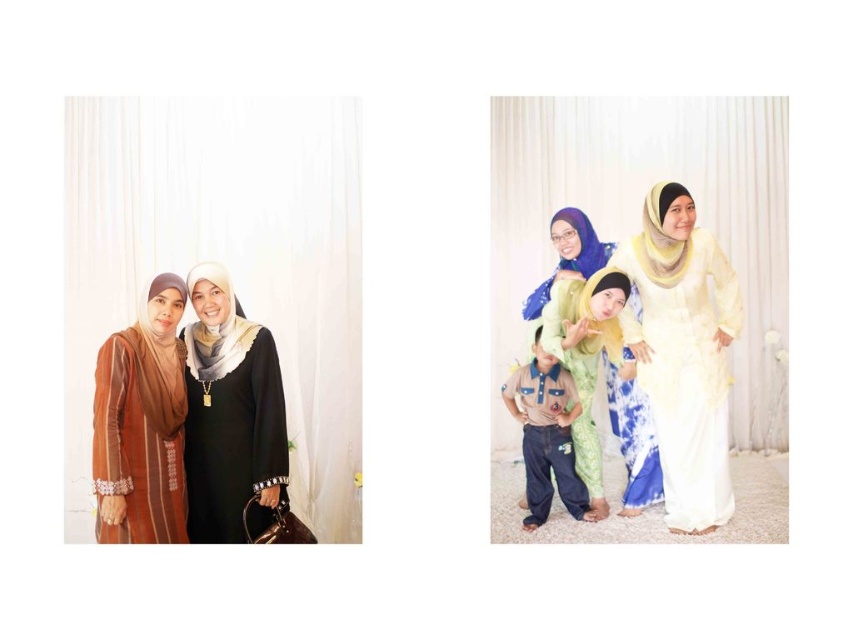
Question: Which point appears farthest from the camera in this image?

Choices:
 (A) (712, 513)
 (B) (579, 262)

Answer: (B)

Question: Does light green fabric dress at center have a larger size compared to denim pants at center?

Choices:
 (A) yes
 (B) no

Answer: (A)

Question: Can you confirm if light green fabric dress at center is wider than yellow satin shawl at upper right?

Choices:
 (A) yes
 (B) no

Answer: (A)

Question: Is light yellow tie-dye dress at center positioned behind matte brown dress at left?

Choices:
 (A) yes
 (B) no

Answer: (A)

Question: Which object is the closest to the matte brown dress at left?

Choices:
 (A) yellow satin shawl at upper right
 (B) black matte abaya at center

Answer: (B)

Question: Which point is farther from the camera taking this photo?

Choices:
 (A) (691, 244)
 (B) (234, 492)
 (C) (134, 536)

Answer: (A)